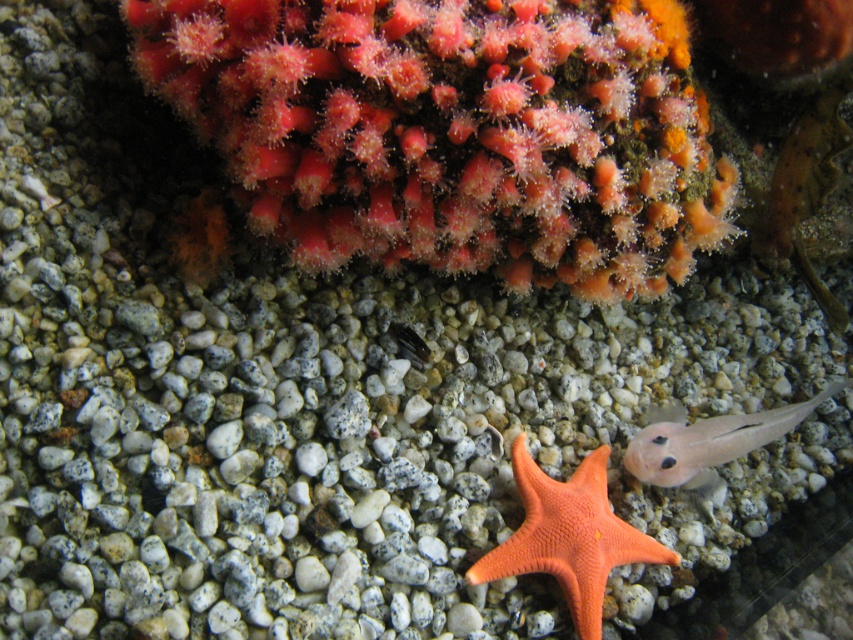
From the picture: You are an underwater explorer observing the aquarium. You spot the orange matte starfish at center and the translucent pink fish at lower right. Which object is positioned to the left of the other?

The orange matte starfish at center is to the left of the translucent pink fish at lower right.